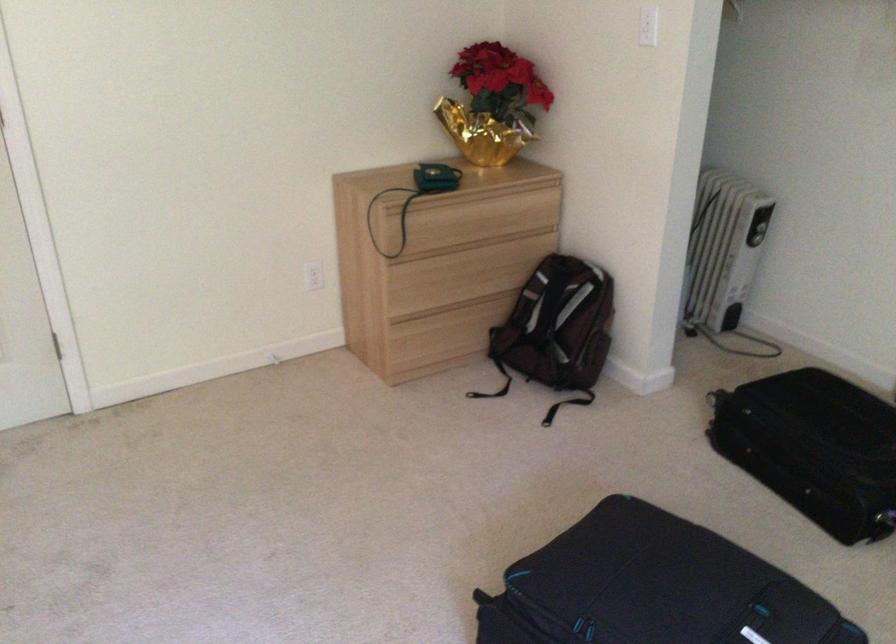
Locate an element on the screen. The width and height of the screenshot is (896, 644). middle drawer front is located at coordinates (435, 277).